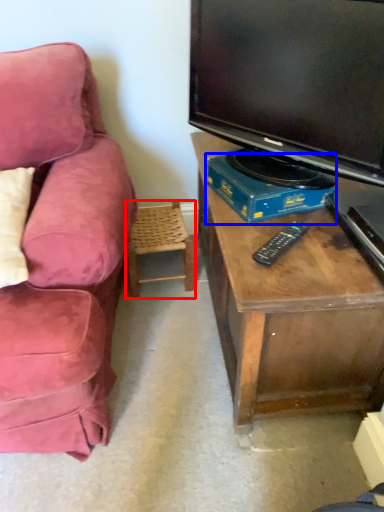
Question: Which object is closer to the camera taking this photo, chair (highlighted by a red box) or book (highlighted by a blue box)?

Choices:
 (A) chair
 (B) book

Answer: (B)